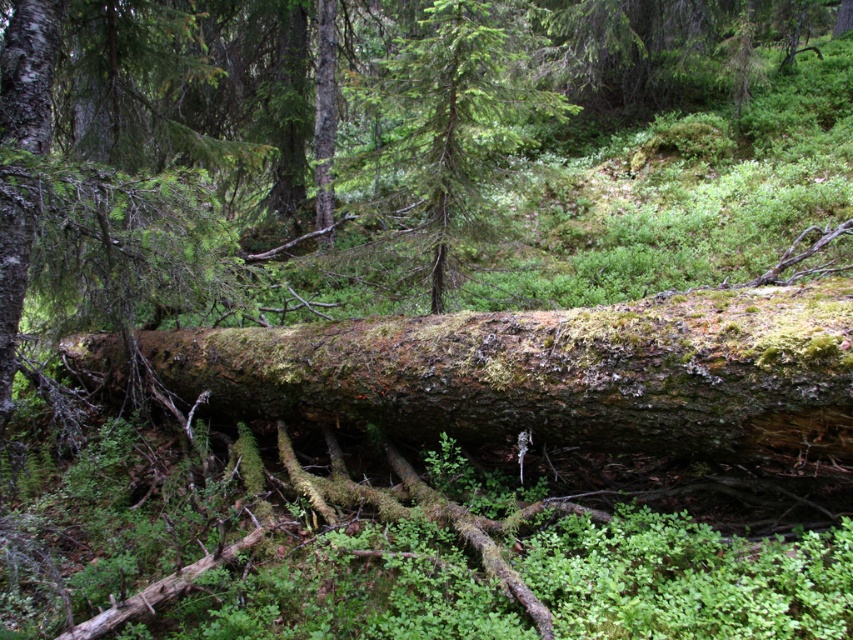
Question: Does mossy bark log at center have a smaller size compared to green rough bark tree at center?

Choices:
 (A) no
 (B) yes

Answer: (A)

Question: Which of the following is the closest to the observer?

Choices:
 (A) (566, 113)
 (B) (746, 403)

Answer: (B)

Question: Which point is farther to the camera?

Choices:
 (A) (718, 362)
 (B) (402, 250)

Answer: (B)

Question: Is mossy bark log at center behind green rough bark tree at center?

Choices:
 (A) no
 (B) yes

Answer: (A)

Question: Does mossy bark log at center have a larger size compared to green rough bark tree at center?

Choices:
 (A) yes
 (B) no

Answer: (A)